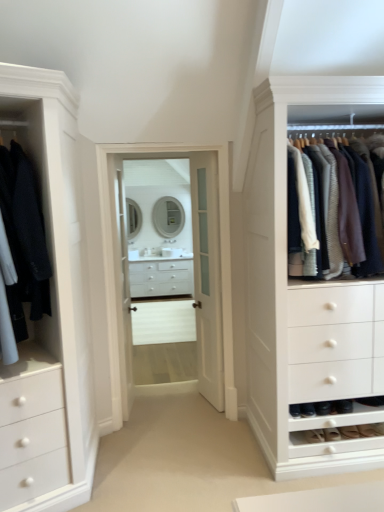
Question: Is clear glass door at center, the first glass door from the left, located outside clear glass door at center, which is the 1th glass door in right-to-left order?

Choices:
 (A) yes
 (B) no

Answer: (A)

Question: From the image's perspective, is clear glass door at center, the first glass door from the left, above clear glass door at center, the 2th glass door in the left-to-right sequence?

Choices:
 (A) yes
 (B) no

Answer: (B)

Question: Can you confirm if clear glass door at center, the first glass door from the left, is positioned to the left of clear glass door at center, the 2th glass door in the left-to-right sequence?

Choices:
 (A) yes
 (B) no

Answer: (A)

Question: Is there a large distance between clear glass door at center, the first glass door from the left, and clear glass door at center, which is the 1th glass door in right-to-left order?

Choices:
 (A) yes
 (B) no

Answer: (B)

Question: Is clear glass door at center, the first glass door from the left, further to camera compared to clear glass door at center, the 2th glass door in the left-to-right sequence?

Choices:
 (A) yes
 (B) no

Answer: (A)

Question: Is clear glass door at center, the first glass door from the left, smaller than clear glass door at center, which is the 1th glass door in right-to-left order?

Choices:
 (A) no
 (B) yes

Answer: (B)

Question: Considering the relative positions of matte silver mirror at center, which ranks as the 1th mirror in left-to-right order, and suede shoe at lower right, the 1th shoe when ordered from left to right, in the image provided, is matte silver mirror at center, which ranks as the 1th mirror in left-to-right order, in front of suede shoe at lower right, the 1th shoe when ordered from left to right,?

Choices:
 (A) yes
 (B) no

Answer: (B)

Question: Can you confirm if matte silver mirror at center, which is the 2th mirror in right-to-left order, is positioned to the left of suede shoe at lower right, positioned as the 2th shoe in right-to-left order?

Choices:
 (A) no
 (B) yes

Answer: (B)

Question: Is matte silver mirror at center, which is the 2th mirror in right-to-left order, located outside suede shoe at lower right, positioned as the 2th shoe in right-to-left order?

Choices:
 (A) no
 (B) yes

Answer: (B)

Question: Would you consider matte silver mirror at center, which ranks as the 1th mirror in left-to-right order, to be distant from suede shoe at lower right, positioned as the 2th shoe in right-to-left order?

Choices:
 (A) yes
 (B) no

Answer: (A)

Question: Is matte silver mirror at center, which is the 2th mirror in right-to-left order, positioned behind suede shoe at lower right, the 1th shoe when ordered from left to right?

Choices:
 (A) no
 (B) yes

Answer: (B)

Question: Can you confirm if matte silver mirror at center, which is the 2th mirror in right-to-left order, is positioned to the right of suede shoe at lower right, positioned as the 2th shoe in right-to-left order?

Choices:
 (A) yes
 (B) no

Answer: (B)

Question: Considering the relative sizes of clear glass door at center, which is the 1th glass door in right-to-left order, and knit sweater at right, which appears as the 1th clothing when viewed from the right, in the image provided, is clear glass door at center, which is the 1th glass door in right-to-left order, wider than knit sweater at right, which appears as the 1th clothing when viewed from the right,?

Choices:
 (A) yes
 (B) no

Answer: (B)